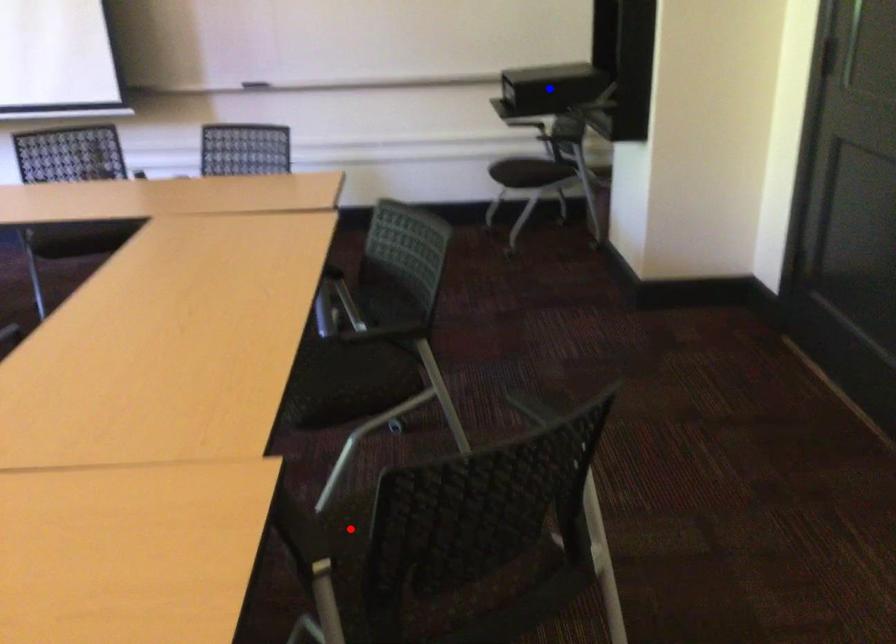
Question: Which of the two points in the image is closer to the camera?

Choices:
 (A) Blue point is closer.
 (B) Red point is closer.

Answer: (B)